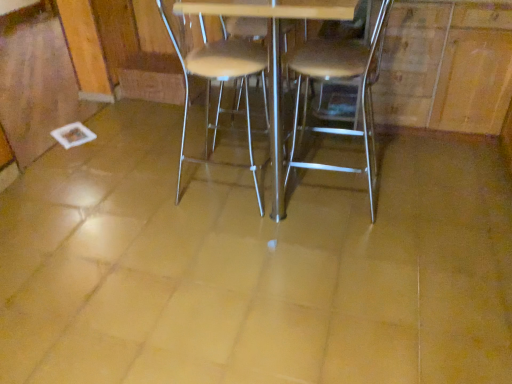
Locate an element on the screen. This screenshot has width=512, height=384. vacant space situated on the left part of metallic silver chair at center, which appears as the first chair when viewed from the left is located at coordinates (153, 192).